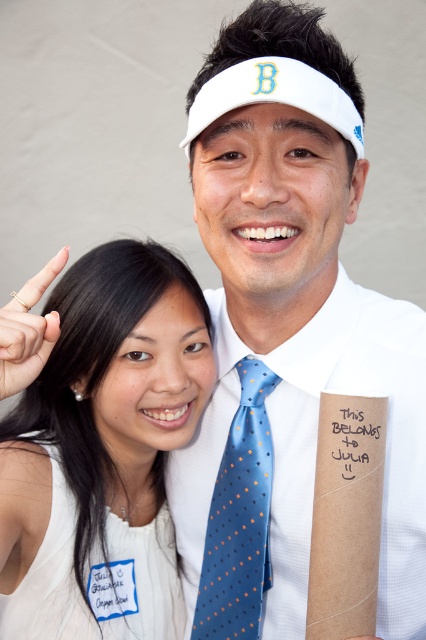
Can you confirm if blue silk tie at center is positioned above white paper at upper center?

No, blue silk tie at center is not above white paper at upper center.

Is blue silk tie at center wider than white paper at upper center?

Yes.

Does point (230, 506) lie in front of point (336, 452)?

No, (230, 506) is behind (336, 452).

Locate an element on the screen. The image size is (426, 640). blue silk tie at center is located at coordinates (238, 518).

Is point (213, 515) farther from camera compared to point (40, 276)?

Yes, point (213, 515) is farther from viewer.

Is blue silk tie at center smaller than gold metallic ring at upper left?

Actually, blue silk tie at center might be larger than gold metallic ring at upper left.

Image resolution: width=426 pixels, height=640 pixels. In order to click on blue silk tie at center in this screenshot , I will do `click(238, 518)`.

Can you confirm if white paper at upper center is shorter than gold metallic ring at upper left?

Correct, white paper at upper center is not as tall as gold metallic ring at upper left.

Is point (359, 467) positioned behind point (6, 353)?

That is True.

Between point (374, 400) and point (40, 348), which one is positioned behind?

Positioned behind is point (374, 400).

Locate an element on the screen. white paper at upper center is located at coordinates (351, 438).